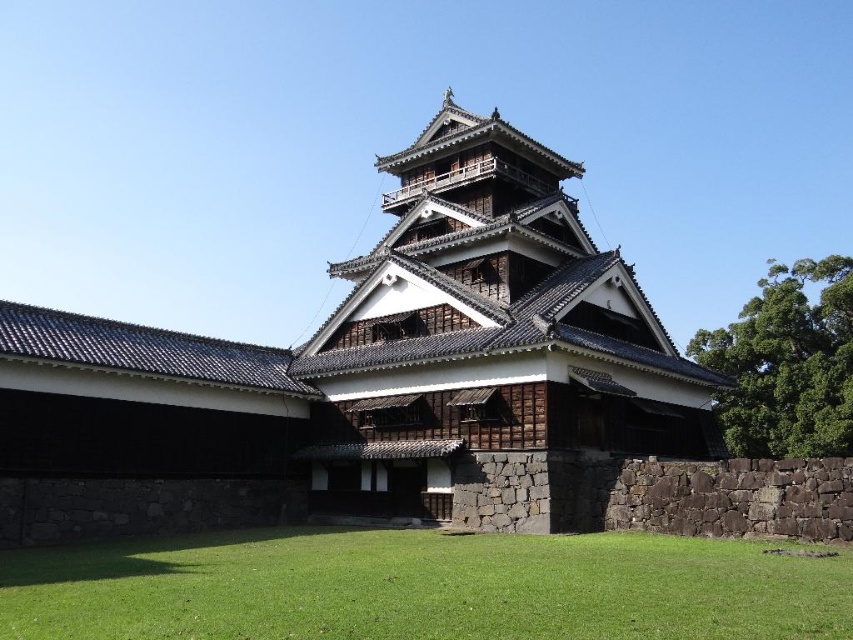
You are standing in front of the traditional Japanese building and want to walk towards the two points marked on the ground. Which point, point (207,520) or point (189,557), is closer to you?

Point (207,520) is closer to you because it is further to the viewer than point (189,557).

You are a gardener planning to plant flowers along the dark brown wood at center and green grass at lower center. Which area requires more flowers if you want to cover the entire width of each area?

The dark brown wood at center requires more flowers because its width surpasses that of the green grass at lower center.